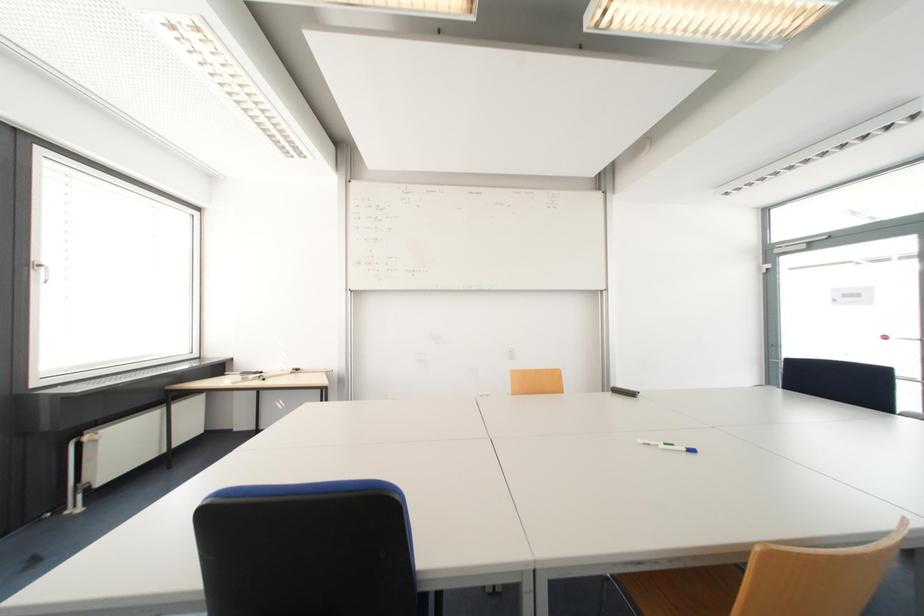
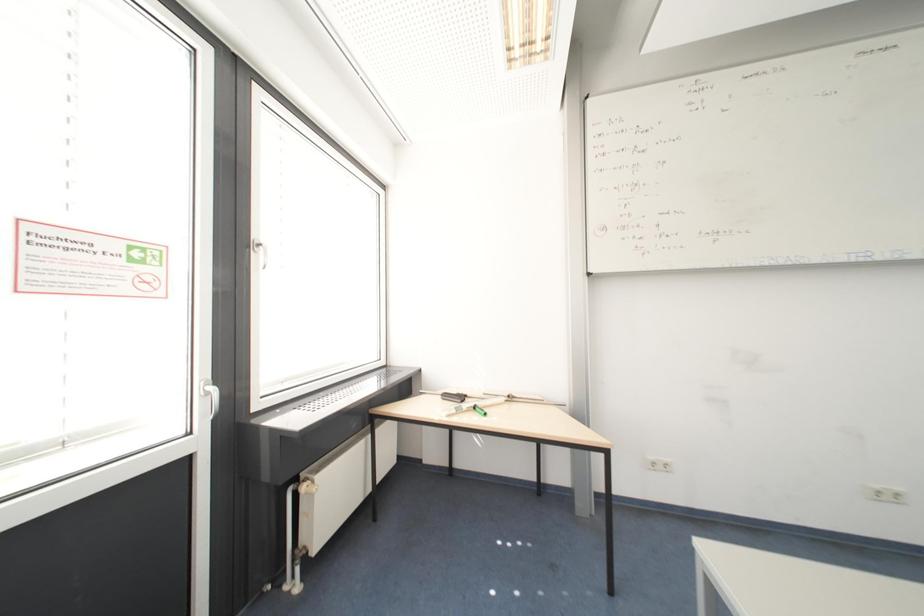
Which direction would the cameraman need to move to produce the second image?

The cameraman moved toward left, forward.